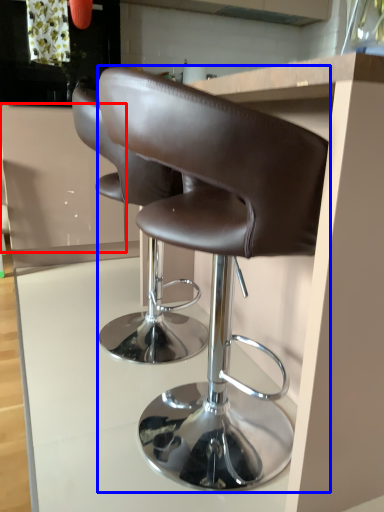
Question: Among these objects, which one is farthest to the camera, cabinetry (highlighted by a red box) or chair (highlighted by a blue box)?

Choices:
 (A) cabinetry
 (B) chair

Answer: (A)